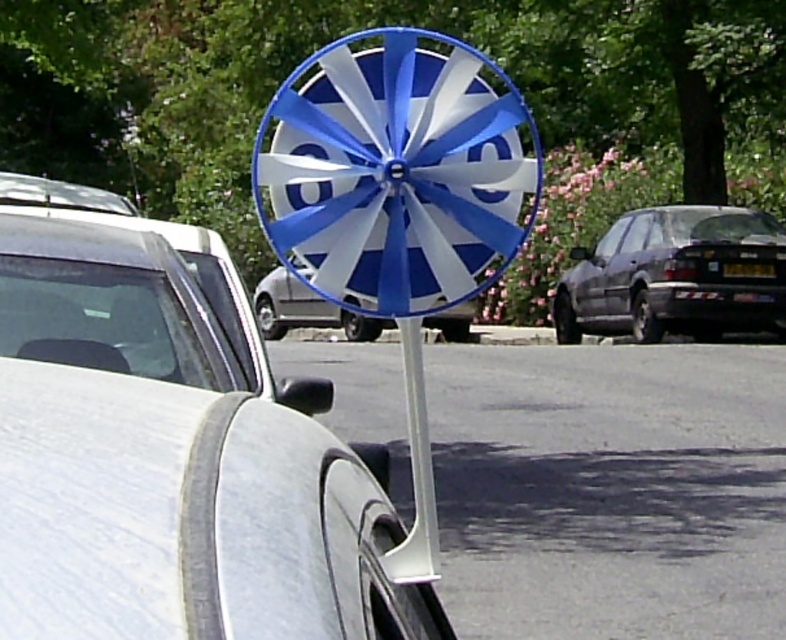
Question: Which point is farther from the camera taking this photo?

Choices:
 (A) (116, 428)
 (B) (674, 268)
 (C) (454, 321)
 (D) (744, 275)

Answer: (C)

Question: Can you confirm if metallic silver van at center is positioned to the right of black plastic license plate at center?

Choices:
 (A) yes
 (B) no

Answer: (B)

Question: Can you confirm if dark gray matte car at right is wider than black plastic license plate at center?

Choices:
 (A) yes
 (B) no

Answer: (A)

Question: Which point is farther from the camera taking this photo?

Choices:
 (A) (656, 333)
 (B) (436, 324)

Answer: (B)

Question: Which object is closer to the camera taking this photo?

Choices:
 (A) metallic silver van at center
 (B) white matte car at center

Answer: (B)

Question: Does dark gray matte car at right appear on the left side of black plastic license plate at center?

Choices:
 (A) yes
 (B) no

Answer: (A)